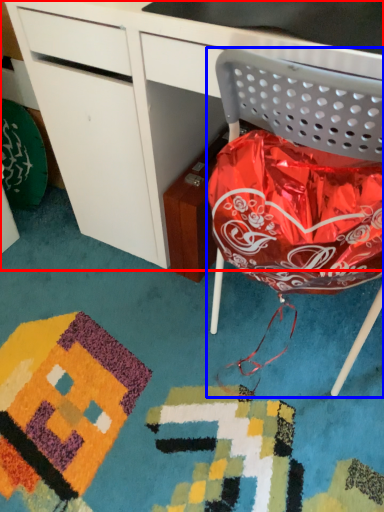
Question: Which of the following is the farthest to the observer, desk (highlighted by a red box) or chair (highlighted by a blue box)?

Choices:
 (A) desk
 (B) chair

Answer: (A)